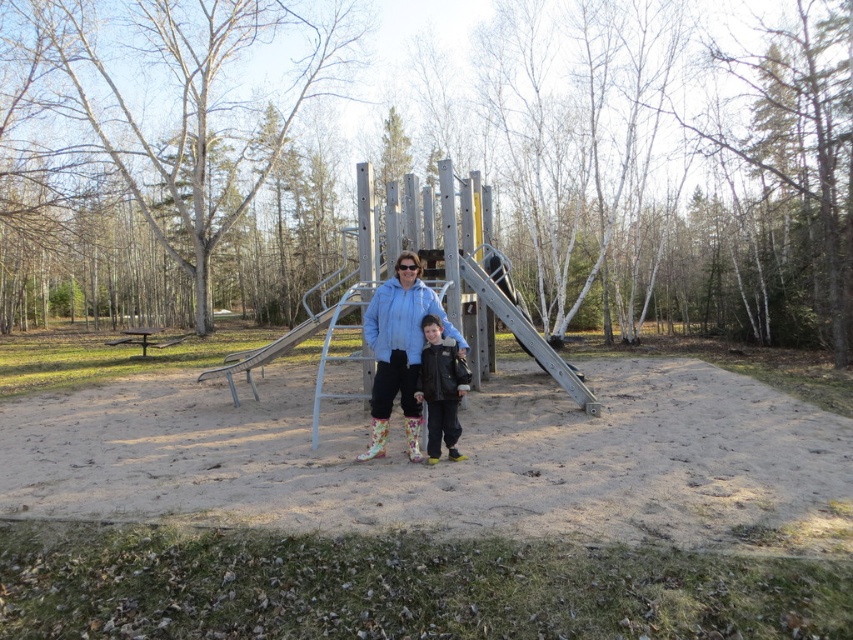
Is point (381, 452) farther from viewer compared to point (437, 385)?

Yes.

Which is behind, point (412, 456) or point (457, 400)?

The point (412, 456) is behind.

At what (x,y) coordinates should I click in order to perform the action: click on matte blue jacket at center. Please return your answer as a coordinate pair (x, y). The height and width of the screenshot is (640, 853). Looking at the image, I should click on click(x=399, y=349).

Which is more to the left, matte blue jacket at center or metallic silver slide at center?

From the viewer's perspective, metallic silver slide at center appears more on the left side.

Which is behind, point (434, 305) or point (224, 371)?

The point (224, 371) is more distant.

Who is more distant from viewer, (457, 349) or (198, 381)?

Point (198, 381)

Find the location of a particular element. matte blue jacket at center is located at coordinates (399, 349).

Does black leather jacket at center come behind metallic silver slide at center?

No, black leather jacket at center is in front of metallic silver slide at center.

Does point (454, 419) come closer to viewer compared to point (262, 348)?

Yes.

The image size is (853, 640). In order to click on black leather jacket at center in this screenshot , I will do `click(440, 388)`.